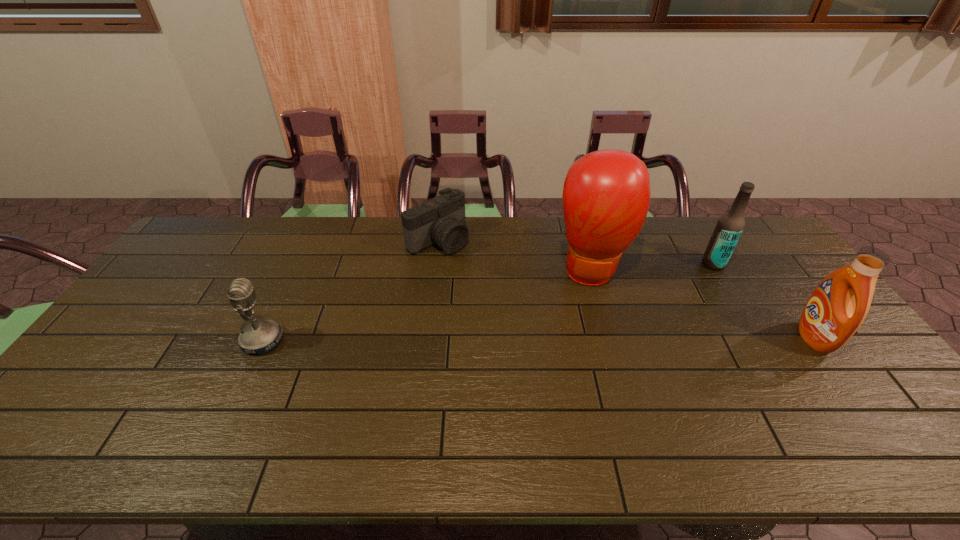
The width and height of the screenshot is (960, 540). What are the coordinates of `vacant point located between the fourth tallest object and the fourth object from left to right` in the screenshot? It's located at (488, 302).

Where is `empty location between the detergent and the leftmost object`? Image resolution: width=960 pixels, height=540 pixels. empty location between the detergent and the leftmost object is located at coordinates (538, 339).

Image resolution: width=960 pixels, height=540 pixels. Find the location of `free space between the camera and the third object from right to left`. free space between the camera and the third object from right to left is located at coordinates (516, 255).

The image size is (960, 540). Find the location of `vacant region between the beer bottle and the tallest object`. vacant region between the beer bottle and the tallest object is located at coordinates (653, 267).

I want to click on unoccupied position between the microphone and the detergent, so click(538, 339).

Image resolution: width=960 pixels, height=540 pixels. Find the location of `free space between the detergent and the tallest object`. free space between the detergent and the tallest object is located at coordinates (703, 304).

Where is `the second closest object to the boxing glove`? the second closest object to the boxing glove is located at coordinates (441, 220).

At what (x,y) coordinates should I click in order to perform the action: click on the third closest object to the second object from right to left. Please return your answer as a coordinate pair (x, y). The width and height of the screenshot is (960, 540). Looking at the image, I should click on (441, 220).

In order to click on free location that satisfies the following two spatial constraints: 1. on the front side of the rightmost object; 2. on the front-facing side of the third object from right to left in this screenshot , I will do `click(612, 338)`.

Locate an element on the screen. free space that satisfies the following two spatial constraints: 1. on the front side of the shortest object; 2. on the left side of the boxing glove is located at coordinates (x=435, y=271).